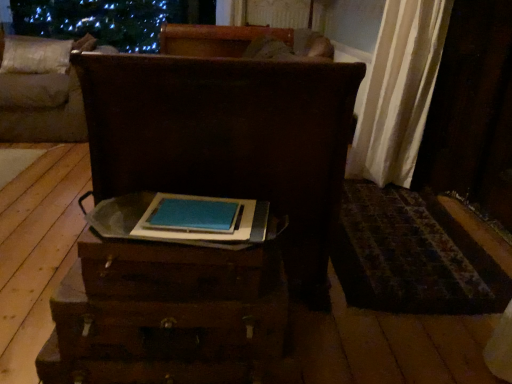
Question: Can you confirm if beige fabric pillow at upper left is wider than brown wooden chest at upper left, which ranks as the 1th furniture in left-to-right order?

Choices:
 (A) no
 (B) yes

Answer: (A)

Question: Is beige fabric pillow at upper left taller than brown wooden chest at upper left, the second furniture viewed from the front?

Choices:
 (A) yes
 (B) no

Answer: (B)

Question: Is beige fabric pillow at upper left smaller than brown wooden chest at upper left, which appears as the 2th furniture when viewed from the right?

Choices:
 (A) no
 (B) yes

Answer: (B)

Question: Is beige fabric pillow at upper left bigger than brown wooden chest at upper left, which ranks as the 1th furniture in left-to-right order?

Choices:
 (A) yes
 (B) no

Answer: (B)

Question: From a real-world perspective, is beige fabric pillow at upper left on top of brown wooden chest at upper left, acting as the 1th furniture starting from the back?

Choices:
 (A) yes
 (B) no

Answer: (A)

Question: Is blue matte book at center taller or shorter than wooden drawer at center?

Choices:
 (A) short
 (B) tall

Answer: (A)

Question: Considering the positions of point (145, 235) and point (110, 352), is point (145, 235) closer or farther from the camera than point (110, 352)?

Choices:
 (A) closer
 (B) farther

Answer: (A)

Question: Is blue matte book at center bigger or smaller than wooden drawer at center?

Choices:
 (A) small
 (B) big

Answer: (A)

Question: From a real-world perspective, is blue matte book at center positioned above or below wooden drawer at center?

Choices:
 (A) below
 (B) above

Answer: (B)

Question: Is point (322, 152) positioned closer to the camera than point (258, 230)?

Choices:
 (A) closer
 (B) farther

Answer: (B)

Question: Considering their positions, is wooden trunk at center, the first furniture when ordered from front to back, located in front of or behind blue matte book at center?

Choices:
 (A) front
 (B) behind

Answer: (B)

Question: From a real-world perspective, is wooden trunk at center, the first furniture when ordered from front to back, above or below blue matte book at center?

Choices:
 (A) below
 (B) above

Answer: (A)

Question: Considering the relative positions of wooden trunk at center, the first furniture when ordered from front to back, and blue matte book at center in the image provided, is wooden trunk at center, the first furniture when ordered from front to back, to the left or to the right of blue matte book at center?

Choices:
 (A) right
 (B) left

Answer: (B)

Question: Would you say wooden trunk at center, the second furniture viewed from the left, is to the left or to the right of beige fabric pillow at upper left in the picture?

Choices:
 (A) right
 (B) left

Answer: (A)

Question: From the image's perspective, is wooden trunk at center, which is the second furniture in back-to-front order, above or below beige fabric pillow at upper left?

Choices:
 (A) above
 (B) below

Answer: (B)